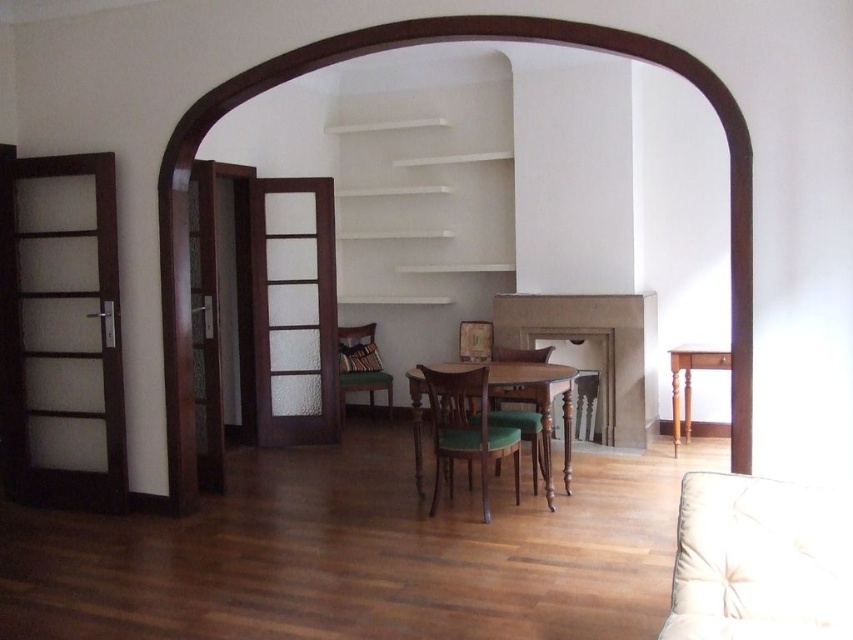
Question: Which object is closer to the camera taking this photo?

Choices:
 (A) beige fabric armchair at lower right
 (B) wooden table at center
 (C) white matte shelves at upper center

Answer: (A)

Question: Does brown wood archway at center appear on the left side of green fabric armchair at center?

Choices:
 (A) no
 (B) yes

Answer: (A)

Question: Which point is closer to the camera?

Choices:
 (A) (521, 420)
 (B) (751, 284)

Answer: (B)

Question: Does brown wood archway at center appear on the left side of green fabric chair at center?

Choices:
 (A) no
 (B) yes

Answer: (B)

Question: Considering the relative positions of green fabric chair at center and light brown wooden table at right in the image provided, where is green fabric chair at center located with respect to light brown wooden table at right?

Choices:
 (A) above
 (B) below

Answer: (B)

Question: Which point is farther to the camera?

Choices:
 (A) (672, 454)
 (B) (544, 465)
 (C) (738, 204)
 (D) (538, 429)

Answer: (A)